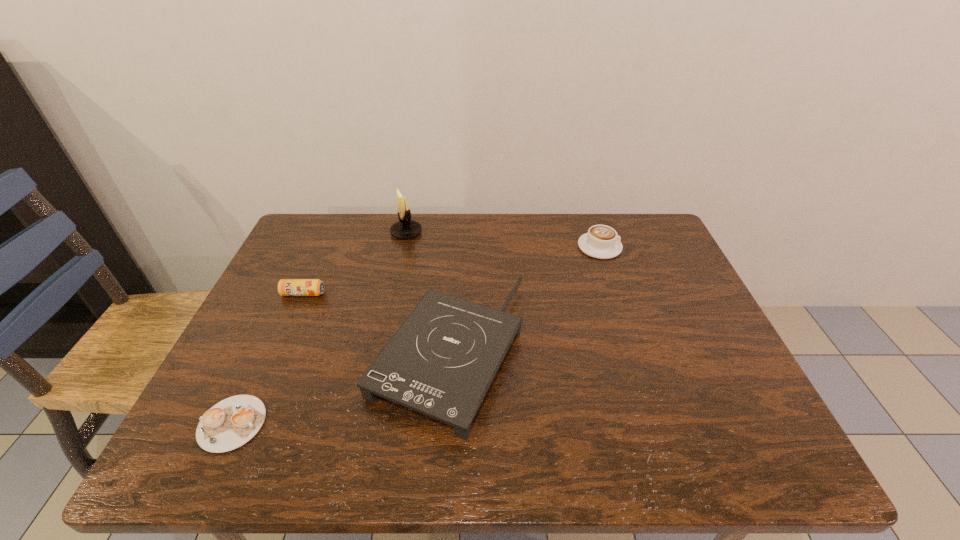
Locate an element on the screen. vacant space in between the tallest object and the farther cappuccino is located at coordinates (503, 240).

This screenshot has width=960, height=540. I want to click on free space that is in between the fourth tallest object and the tallest object, so click(354, 263).

You are a GUI agent. You are given a task and a screenshot of the screen. Output one action in this format:
    pyautogui.click(x=<x>, y=<y>)
    Task: Click on the vacant region between the tallest object and the nearer cappuccino
    
    Given the screenshot: What is the action you would take?
    pyautogui.click(x=319, y=328)

This screenshot has width=960, height=540. Find the location of `free area in between the right cappuccino and the candle holder`. free area in between the right cappuccino and the candle holder is located at coordinates (503, 240).

Identify the location of the closest object relative to the shortest object. Image resolution: width=960 pixels, height=540 pixels. (442, 360).

Where is `object that is the second nearest to the taller cappuccino`? The height and width of the screenshot is (540, 960). object that is the second nearest to the taller cappuccino is located at coordinates (405, 228).

Where is `vacant area in the image that satisfies the following two spatial constraints: 1. on the front side of the hotplate; 2. on the left side of the second shortest object`? vacant area in the image that satisfies the following two spatial constraints: 1. on the front side of the hotplate; 2. on the left side of the second shortest object is located at coordinates (277, 352).

Find the location of a particular element. The width and height of the screenshot is (960, 540). vacant space that satisfies the following two spatial constraints: 1. on the back side of the hotplate; 2. on the left side of the left cappuccino is located at coordinates (266, 352).

Locate an element on the screen. The image size is (960, 540). free space that satisfies the following two spatial constraints: 1. with the handle on the right side of the taller cappuccino; 2. on the front side of the beer can is located at coordinates (615, 294).